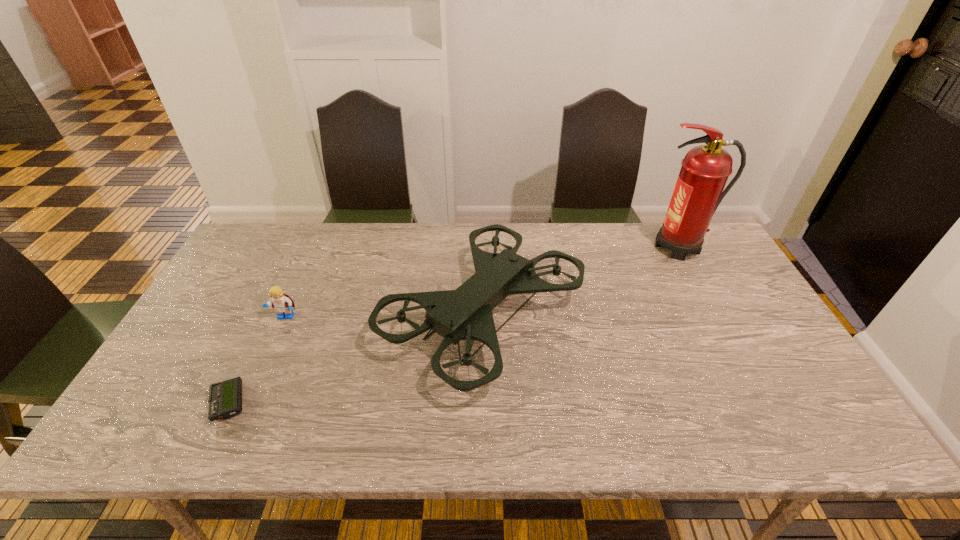
Select which object appears as the third closest to the second shortest object. Please provide its 2D coordinates. Your answer should be formatted as a tuple, i.e. [(x, y)], where the tuple contains the x and y coordinates of a point satisfying the conditions above.

[(705, 169)]

I want to click on free space that satisfies the following two spatial constraints: 1. on the front-facing side of the rightmost object; 2. on the front-facing side of the third tallest object, so click(718, 318).

Identify the location of vacant position in the image that satisfies the following two spatial constraints: 1. on the front-facing side of the rightmost object; 2. on the front-facing side of the Lego. The image size is (960, 540). coord(718,318).

This screenshot has height=540, width=960. I want to click on free point that satisfies the following two spatial constraints: 1. on the front-facing side of the tallest object; 2. on the front-facing side of the Lego, so click(x=718, y=318).

Locate an element on the screen. This screenshot has width=960, height=540. vacant space that satisfies the following two spatial constraints: 1. on the front-facing side of the tallest object; 2. on the front side of the second tallest object is located at coordinates (716, 315).